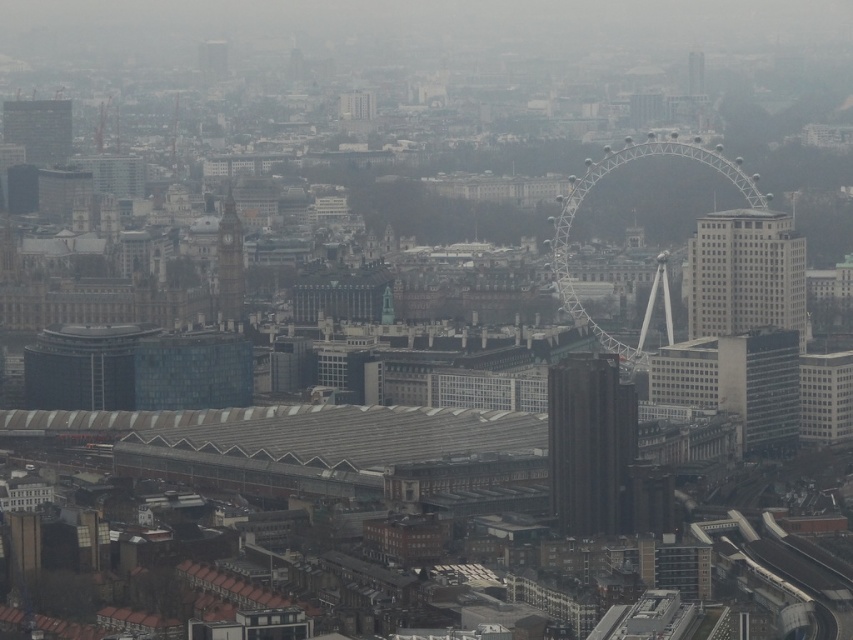
You are a drone operator tasked with flying a drone between the smooth black tower at center and the matte glass skyscraper at upper left. The drone has a maximum flight distance of 400 feet. Can you safely fly the drone between these two structures without exceeding its range?

The smooth black tower at center and the matte glass skyscraper at upper left are 435.57 feet apart from each other. Since the drone can only fly up to 400 feet, it cannot safely fly between them without exceeding its range.

Based on the provided scene description, what are the coordinates of the smooth black tower at center?

The smooth black tower at center is located at coordinates point (590, 444).

You are a drone operator flying a drone that can travel up to 600 meters. You are instructed to fly the drone from your current position to the smooth black tower at center. Will the drone be able to reach it?

The smooth black tower at center is 646.86 meters away from viewer, so the drone cannot reach it since its maximum range is 600 meters.